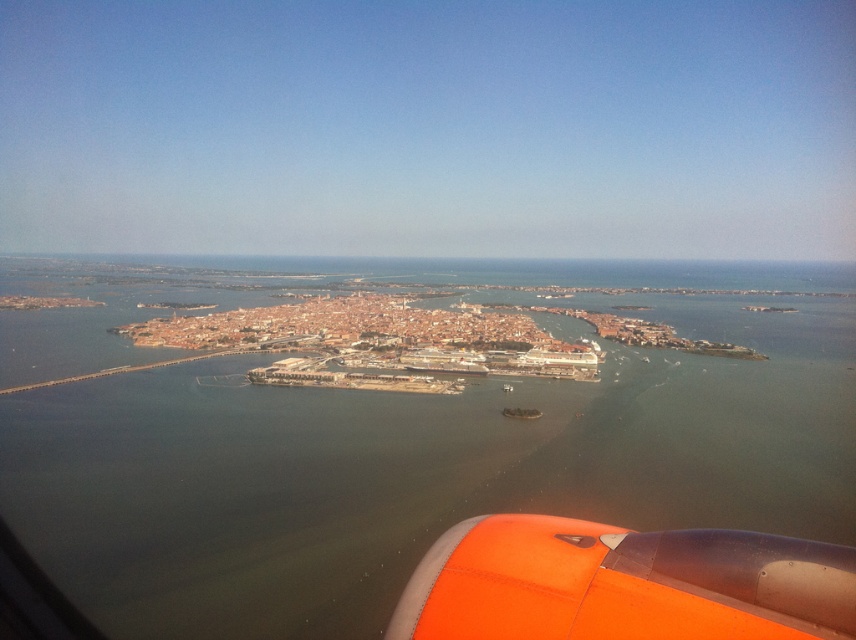
You are a passenger seated near the window and want to take a photo of the brown water at center and orange matte engine at lower right. Which object should you pan your camera to the right to capture?

To capture the orange matte engine at lower right, you should pan your camera to the right since it is positioned to the right of the brown water at center.

You are a passenger sitting near the window of an airplane and see two points marked on the view outside. The first point is at coordinate point (661, 416) and the second is at point (586, 534). Which point is closer to you?

Point (661, 416) is closer to you because it is further to the viewer than point (586, 534).